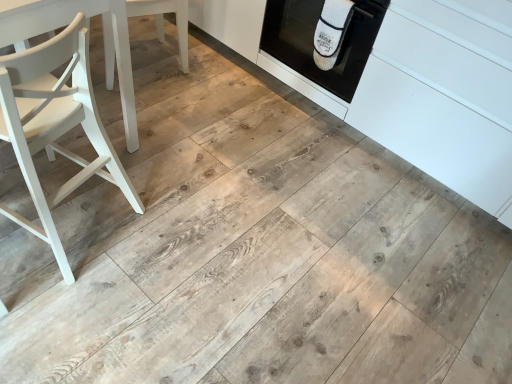
Question: Can we say white ribbed oven mitt at upper right lies outside white ribbed oven mitt at upper right?

Choices:
 (A) no
 (B) yes

Answer: (A)

Question: Could you tell me if white ribbed oven mitt at upper right is facing white ribbed oven mitt at upper right?

Choices:
 (A) no
 (B) yes

Answer: (B)

Question: Is white ribbed oven mitt at upper right at the left side of white ribbed oven mitt at upper right?

Choices:
 (A) no
 (B) yes

Answer: (B)

Question: Is the position of white ribbed oven mitt at upper right less distant than that of white ribbed oven mitt at upper right?

Choices:
 (A) no
 (B) yes

Answer: (A)

Question: Would you say white ribbed oven mitt at upper right is part of white ribbed oven mitt at upper right's contents?

Choices:
 (A) yes
 (B) no

Answer: (B)

Question: From a real-world perspective, is white ribbed oven mitt at upper right positioned over white ribbed oven mitt at upper right based on gravity?

Choices:
 (A) yes
 (B) no

Answer: (A)

Question: Are white ribbed oven mitt at upper right and white matte cabinetry at center far apart?

Choices:
 (A) yes
 (B) no

Answer: (B)

Question: Is white ribbed oven mitt at upper right looking in the opposite direction of white matte cabinetry at center?

Choices:
 (A) yes
 (B) no

Answer: (A)

Question: Does white ribbed oven mitt at upper right turn towards white matte cabinetry at center?

Choices:
 (A) yes
 (B) no

Answer: (B)

Question: Is white ribbed oven mitt at upper right next to white matte cabinetry at center and touching it?

Choices:
 (A) no
 (B) yes

Answer: (A)

Question: Can you confirm if white ribbed oven mitt at upper right is wider than white matte cabinetry at center?

Choices:
 (A) no
 (B) yes

Answer: (A)

Question: From a real-world perspective, is white ribbed oven mitt at upper right located higher than white matte cabinetry at center?

Choices:
 (A) yes
 (B) no

Answer: (A)

Question: Considering the relative sizes of white matte wood chair at left, the 2th chair positioned from the front, and white matte cabinetry at center in the image provided, is white matte wood chair at left, the 2th chair positioned from the front, thinner than white matte cabinetry at center?

Choices:
 (A) no
 (B) yes

Answer: (B)